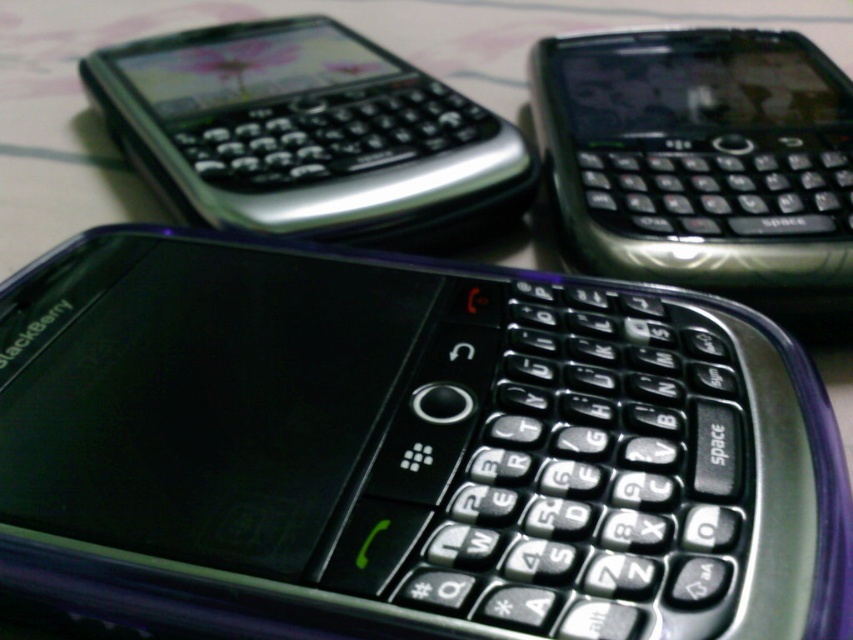
You are a photographer trying to capture a closeup of the BlackBerry smartphones. You want to focus on the point at position (550, 115). Will this point be in focus if you focus on the point at (102, 54)?

Point (550, 115) is closer to the camera than point (102, 54), so focusing on point (102, 54) would mean the point at (550, 115) is out of focus.

You are arranging three BlackBerry smartphones on a table. You have a black glossy phone at upper right and a satin silver phone at upper left. Which one is located to the right of the other?

The black glossy phone at upper right is positioned on the right side of the satin silver phone at upper left.